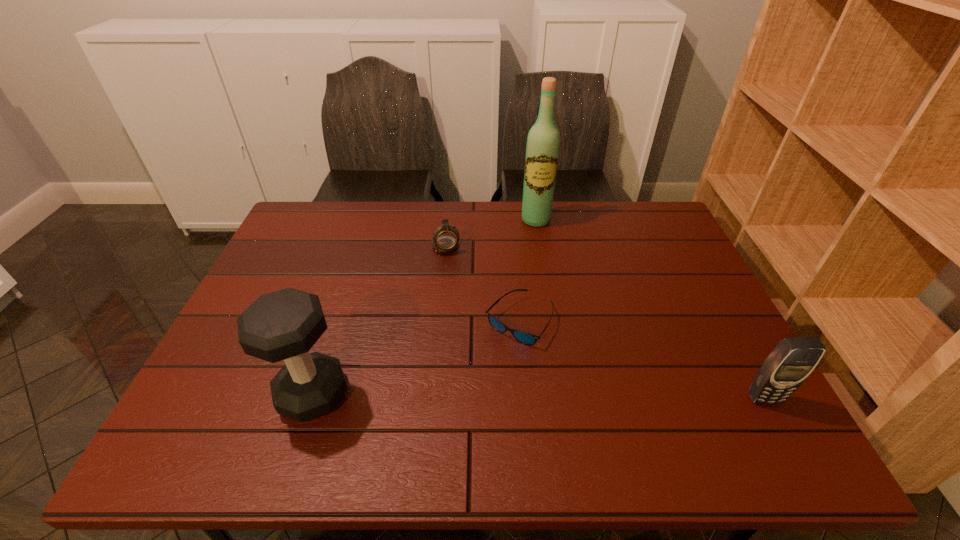
Locate an element on the screen. free space on the desktop that is between the dumbbell and the rightmost object and is positioned on the face of the second shortest object is located at coordinates (484, 395).

You are a GUI agent. You are given a task and a screenshot of the screen. Output one action in this format:
    pyautogui.click(x=<x>, y=<y>)
    Task: Click on the free space on the desktop that is between the dumbbell and the rightmost object and is positioned at the front of the sunglasses showing the lenses
    Image resolution: width=960 pixels, height=540 pixels.
    Given the screenshot: What is the action you would take?
    tap(528, 396)

I want to click on vacant spot on the desktop that is between the leftmost object and the cellular telephone and is positioned on the front-facing side of the tallest object, so click(x=549, y=396).